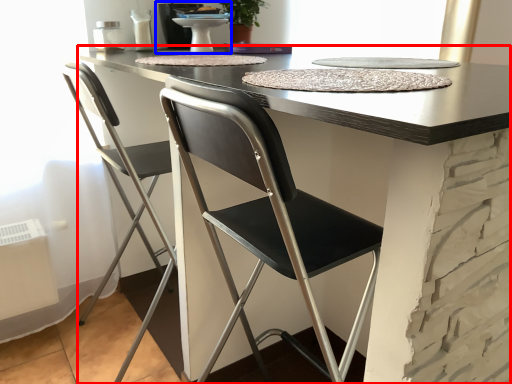
Question: Which object is further to the camera taking this photo, table (highlighted by a red box) or sink (highlighted by a blue box)?

Choices:
 (A) table
 (B) sink

Answer: (B)